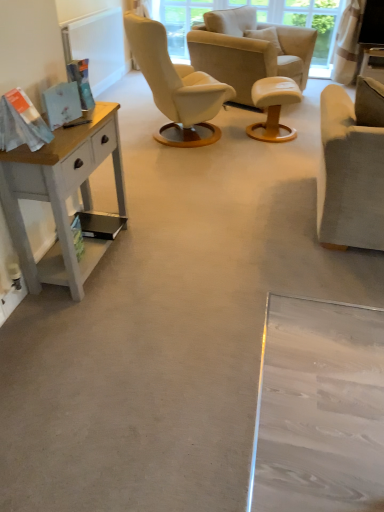
At what (x,y) coordinates should I click in order to perform the action: click on free point to the right of white painted wood desk at left. Please return your answer as a coordinate pair (x, y). Image resolution: width=384 pixels, height=512 pixels. Looking at the image, I should click on click(x=163, y=259).